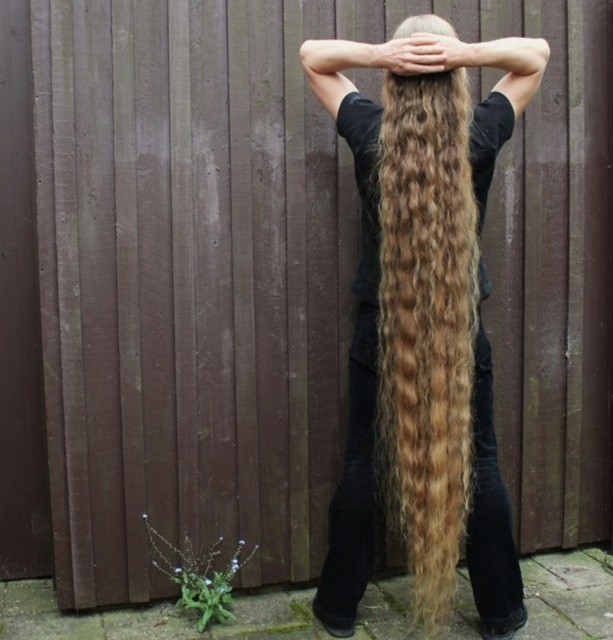
Question: Can you confirm if golden wavy hair at back is positioned above blonde curly hair at center?

Choices:
 (A) yes
 (B) no

Answer: (B)

Question: Does golden wavy hair at center appear under golden wavy hair at back?

Choices:
 (A) yes
 (B) no

Answer: (B)

Question: Which point appears farthest from the camera in this image?

Choices:
 (A) (454, 36)
 (B) (440, 156)
 (C) (409, 252)

Answer: (A)

Question: Does golden wavy hair at center appear under blonde curly hair at center?

Choices:
 (A) no
 (B) yes

Answer: (B)

Question: Among these points, which one is nearest to the camera?

Choices:
 (A) (419, 20)
 (B) (394, 336)
 (C) (476, 515)

Answer: (B)

Question: Which object appears farthest from the camera in this image?

Choices:
 (A) golden wavy hair at center
 (B) golden wavy hair at back
 (C) blonde curly hair at center

Answer: (C)